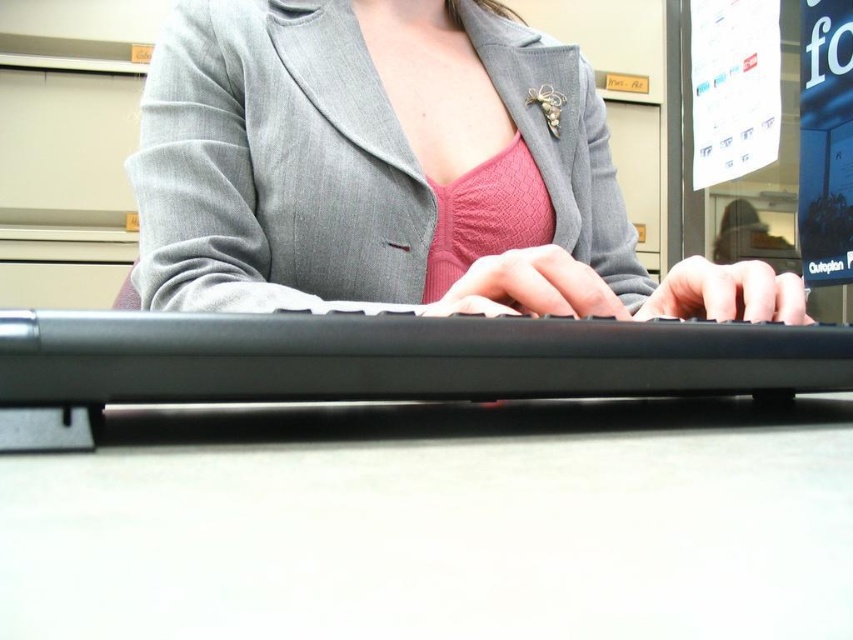
Can you confirm if gray woolen blazer at center is thinner than black plastic keyboard at center?

In fact, gray woolen blazer at center might be wider than black plastic keyboard at center.

Does gray woolen blazer at center have a greater width compared to black plastic keyboard at center?

Yes.

Who is more forward, (364, 285) or (782, 326)?

Point (782, 326)

Locate an element on the screen. This screenshot has height=640, width=853. gray woolen blazer at center is located at coordinates click(x=376, y=164).

Is white matte table at center positioned behind black plastic keyboard at center?

No, it is not.

Looking at this image, between white matte table at center and black plastic keyboard at center, which one is positioned higher?

Positioned higher is black plastic keyboard at center.

Which is behind, point (660, 545) or point (676, 333)?

Positioned behind is point (676, 333).

In order to click on white matte table at center in this screenshot , I will do `click(438, 524)`.

Is white matte table at center in front of gray woolen blazer at center?

That is True.

Does point (410, 593) come in front of point (352, 76)?

Yes, point (410, 593) is closer to viewer.

Find the location of a particular element. Image resolution: width=853 pixels, height=640 pixels. white matte table at center is located at coordinates (438, 524).

Where is `white matte table at center`? This screenshot has height=640, width=853. white matte table at center is located at coordinates (438, 524).